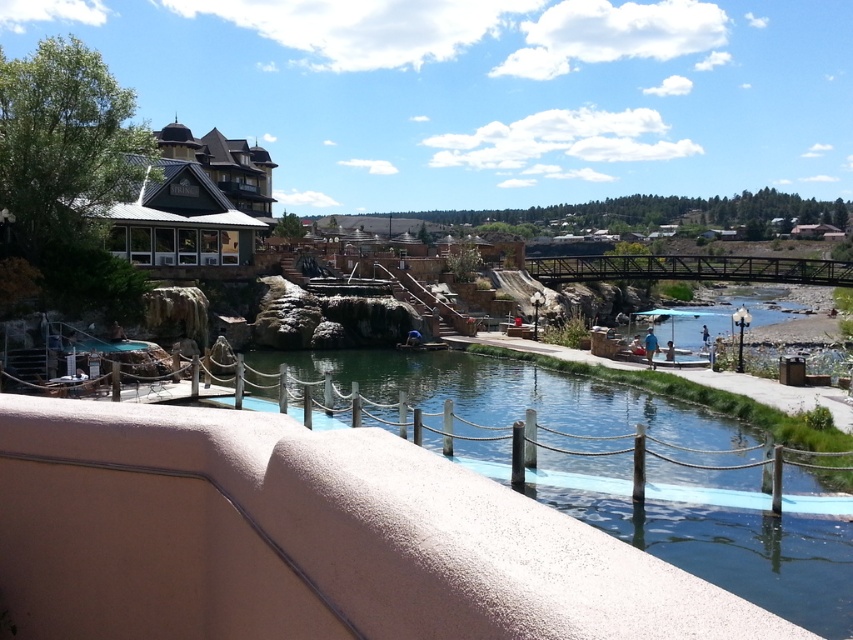
You are standing on the black metal bridge at center and want to look at the green shingles at upper left. In which direction should you look?

The green shingles at upper left are above the black metal bridge at center, so you should look upward to see them.

You are planning to install a decorative flagpole in this outdoor area. The flagpole requires a base that must be placed on a surface higher than its surroundings to ensure visibility. Based on the scene, which object between the smooth concrete river at center and the green shingles at upper left would be the better choice for placing the flagpole base?

The green shingles at upper left would be the better choice for placing the flagpole base since they have a greater height compared to the smooth concrete river at center, ensuring the flagpole is visible above its surroundings.

From the picture: You are planning to cross from one side of the smooth concrete river at center to the other. The black metal bridge at center is the only available path. Can you safely cross using the bridge?

The smooth concrete river at center is shorter than the black metal bridge at center, so the bridge spans the entire width of the river. Therefore, you can safely cross using the black metal bridge at center.